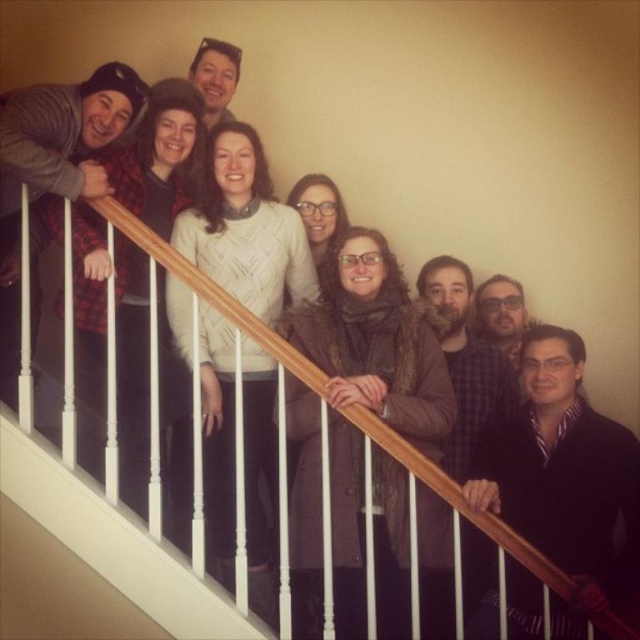
Question: Based on their relative distances, which object is farther from the brown fuzzy coat at center?

Choices:
 (A) wooden handrail at center
 (B) white knitted sweater at center

Answer: (A)

Question: Which of the following is the farthest from the observer?

Choices:
 (A) brown fuzzy coat at center
 (B) white knitted sweater at center
 (C) wooden handrail at center

Answer: (B)

Question: Can you confirm if brown fuzzy coat at center is wider than wooden handrail at center?

Choices:
 (A) no
 (B) yes

Answer: (A)

Question: Can you confirm if brown fuzzy coat at center is positioned to the left of wooden handrail at center?

Choices:
 (A) yes
 (B) no

Answer: (B)

Question: Which point is farther to the camera?

Choices:
 (A) wooden handrail at center
 (B) brown fuzzy coat at center
 (C) white knitted sweater at center

Answer: (C)

Question: Does brown fuzzy coat at center have a larger size compared to white knitted sweater at center?

Choices:
 (A) no
 (B) yes

Answer: (B)